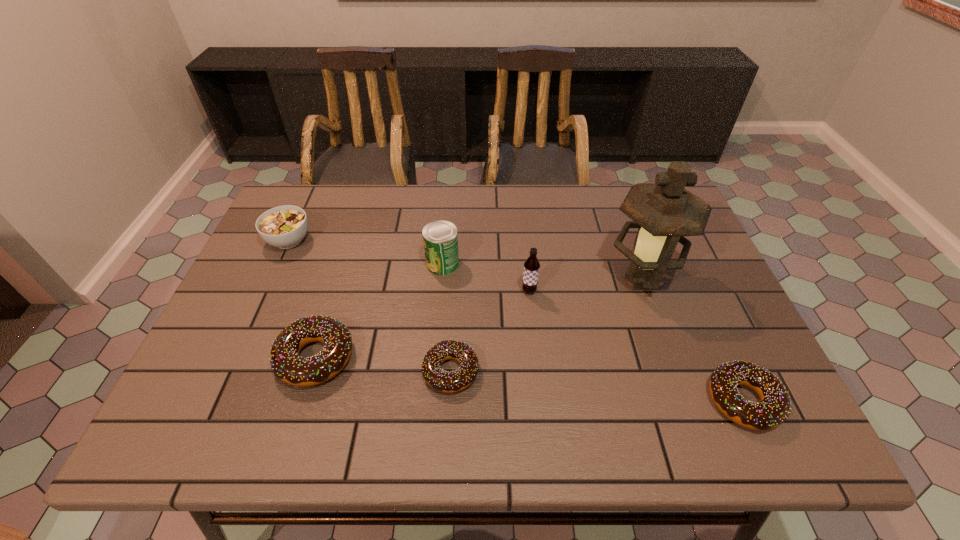
Identify the location of free space between the second object from left to right and the can. This screenshot has width=960, height=540. (379, 310).

Where is `empty location between the oil lamp and the shortest doughnut`? The width and height of the screenshot is (960, 540). empty location between the oil lamp and the shortest doughnut is located at coordinates (546, 324).

Where is `free space between the leftmost doughnut and the fourth tallest object`? This screenshot has height=540, width=960. free space between the leftmost doughnut and the fourth tallest object is located at coordinates (302, 299).

Identify the location of free spot between the oil lamp and the second doughnut from right to left. (546, 324).

Where is `unoccupied position between the rightmost doughnut and the sixth object from right to left`? The width and height of the screenshot is (960, 540). unoccupied position between the rightmost doughnut and the sixth object from right to left is located at coordinates (530, 379).

The image size is (960, 540). Identify the location of vacant space that's between the tallest object and the shortest object. pos(546,324).

The width and height of the screenshot is (960, 540). Identify the location of free point between the sixth object from right to left and the shortest doughnut. (383, 364).

I want to click on free space that is in between the can and the leftmost doughnut, so click(x=379, y=310).

Locate an element on the screen. blank region between the fourth shortest object and the second doughnut from right to left is located at coordinates (371, 306).

Image resolution: width=960 pixels, height=540 pixels. What are the coordinates of `object that is the fifth nearest to the oil lamp` in the screenshot? It's located at [x=287, y=365].